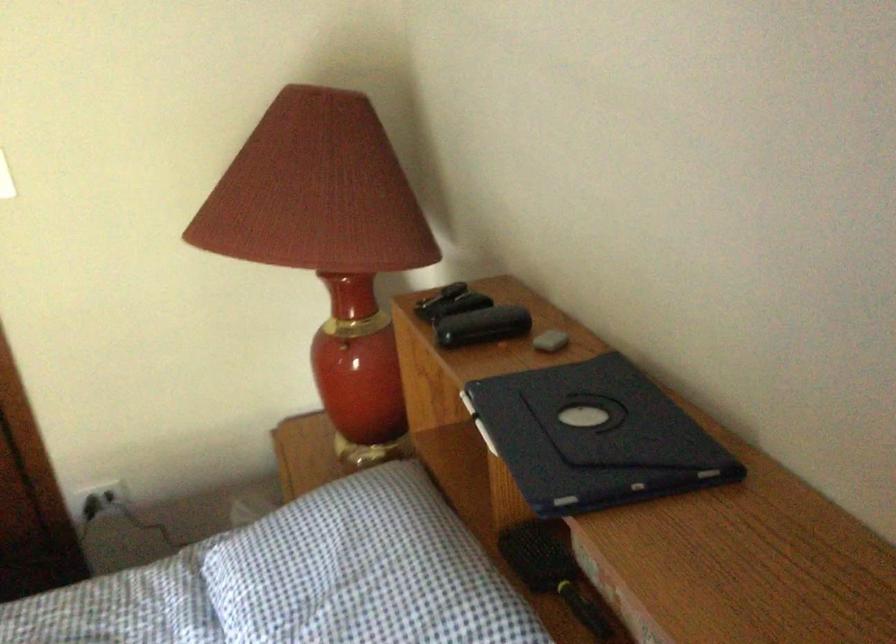
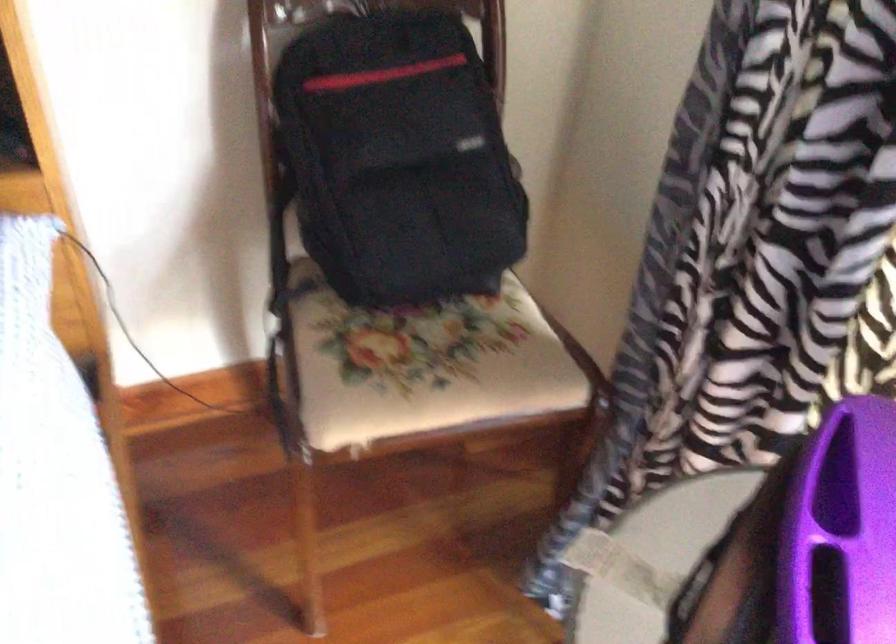
How did the camera likely rotate?

The rotation direction of the camera is right-down.